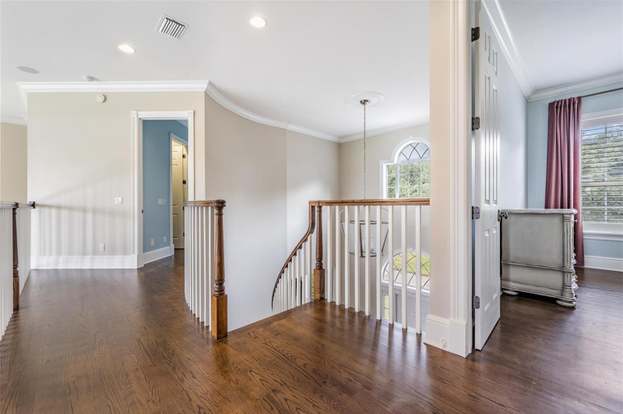
The height and width of the screenshot is (414, 623). I want to click on base board, so [146, 255], [98, 264].